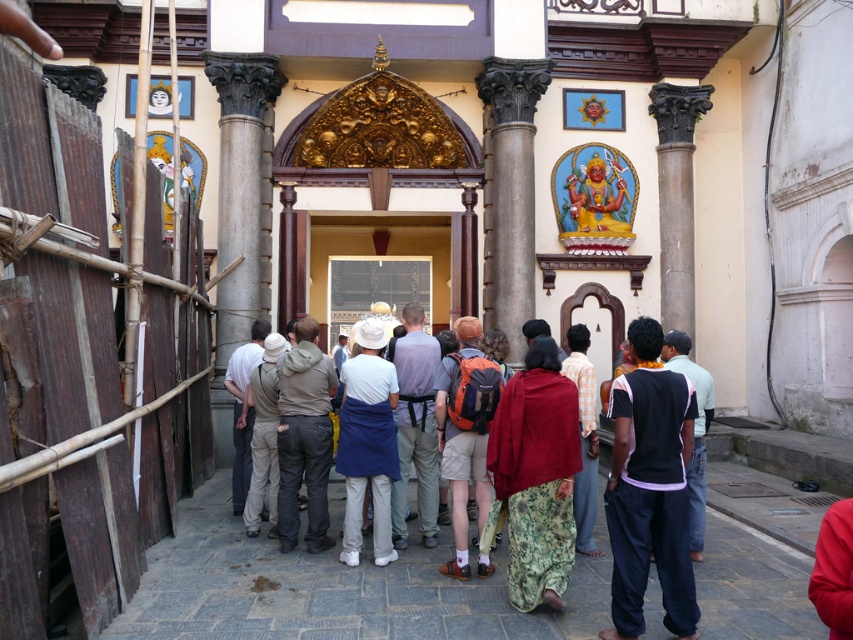
You are a photographer planning to take a portrait of a person wearing dark gray pants at center and black cotton shirt at right. You want to ensure that both items of clothing are clearly visible in the frame. Based on their widths, which clothing item should you focus on to ensure proper framing?

The dark gray pants at center has a smaller width compared to the black cotton shirt at right. To ensure proper framing, focus on the black cotton shirt at right since it is wider and will require more attention to capture its details clearly.

You are standing at the entrance of the temple and want to take a photo of the gray stone column at center. Which direction should you face to capture it in your shot?

The gray stone column at center is located at point [512,163], so you should face towards the center of the temple to capture it in your photo.

You are a photographer standing at the entrance of the temple. You want to take a photo that includes both the gray stone column at center and the dark gray pants at center. Which object should you position to the left side of your frame to ensure both are in the shot?

You should position the dark gray pants at center to the left side of your frame because the gray stone column at center is to the right of it, ensuring both are included in the photo.